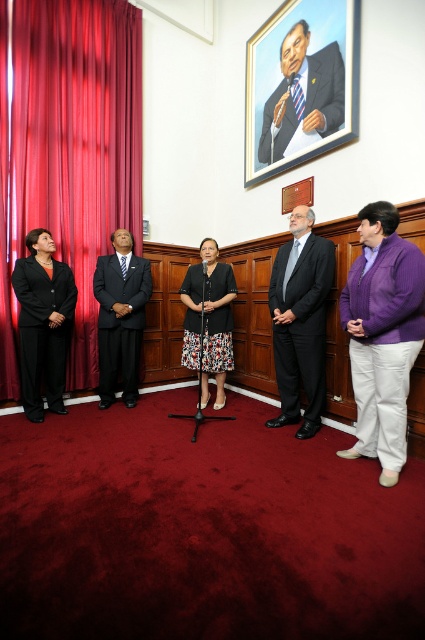
Question: Does purple fleece jacket at right appear on the right side of black matte suit at left?

Choices:
 (A) no
 (B) yes

Answer: (B)

Question: Which of the following is the farthest from the observer?

Choices:
 (A) dark gray suit at center
 (B) purple fleece jacket at right

Answer: (A)

Question: Is floral-patterned dress at center to the left of blue striped tie at upper center from the viewer's perspective?

Choices:
 (A) yes
 (B) no

Answer: (A)

Question: Is floral-patterned dress at center smaller than blue striped tie at upper center?

Choices:
 (A) no
 (B) yes

Answer: (A)

Question: Which object is farther from the camera taking this photo?

Choices:
 (A) oil painting portrait at upper center
 (B) purple fleece jacket at right

Answer: (A)

Question: Which of the following is the farthest from the observer?

Choices:
 (A) (271, 58)
 (B) (65, 228)

Answer: (A)